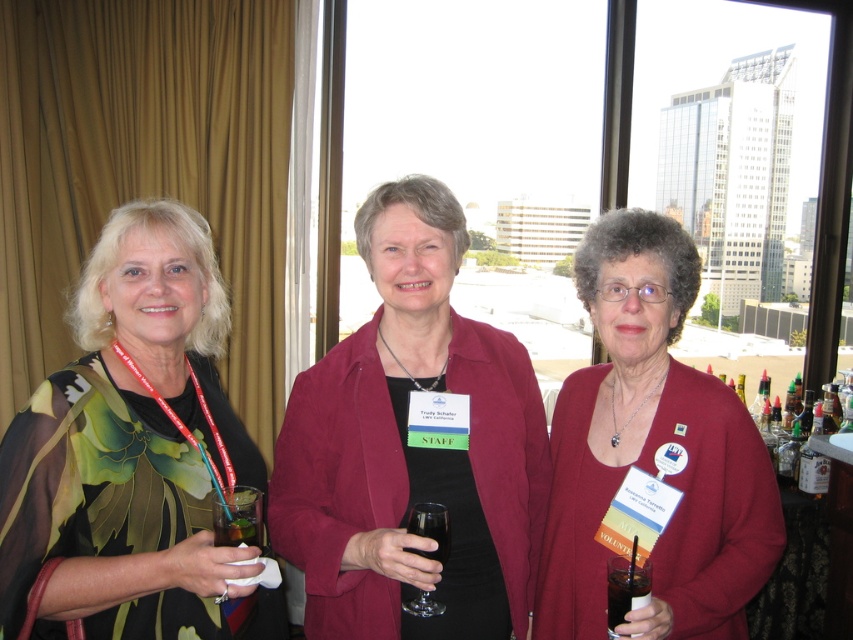
Question: Which point is closer to the camera?

Choices:
 (A) maroon sweater at center
 (B) dark liquid glass at center
 (C) maroon suede jacket at center

Answer: (B)

Question: Is maroon suede jacket at center wider than dark liquid glass at center?

Choices:
 (A) no
 (B) yes

Answer: (B)

Question: Observing the image, what is the correct spatial positioning of maroon suede jacket at center in reference to transparent glass at center?

Choices:
 (A) right
 (B) left

Answer: (A)

Question: Estimate the real-world distances between objects in this image. Which object is farther from the floral-patterned fabric at left?

Choices:
 (A) transparent glass at center
 (B) maroon suede jacket at center

Answer: (A)

Question: Which point is farther to the camera?

Choices:
 (A) dark liquid glass at center
 (B) maroon sweater at center
 (C) maroon suede jacket at center
 (D) floral-patterned fabric at left

Answer: (C)

Question: Is floral-patterned fabric at left thinner than transparent glass at center?

Choices:
 (A) yes
 (B) no

Answer: (B)